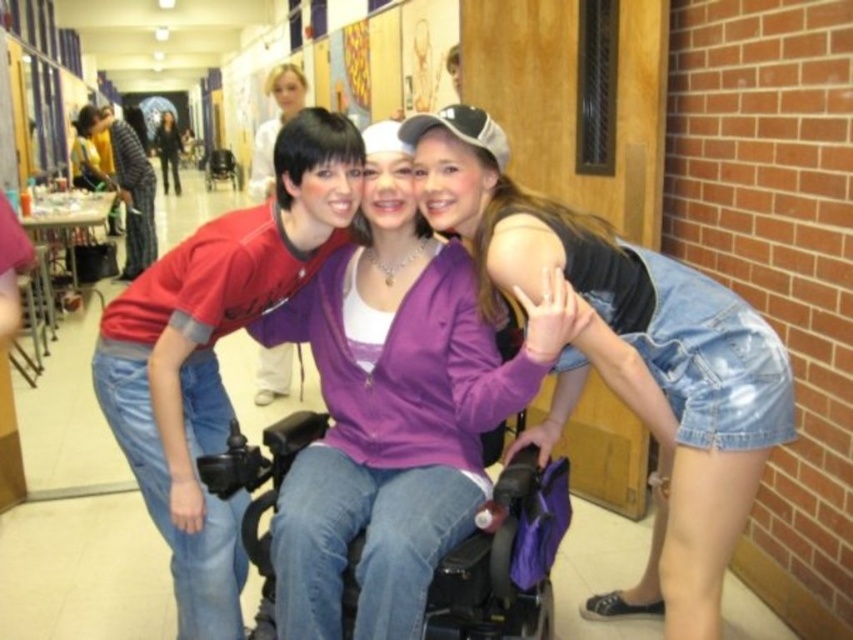
You are a student walking down the hallway and notice the denim shorts at right and the black plastic wheelchair at center. Which object is taller from your perspective?

The denim shorts at right is taller than the black plastic wheelchair at center.

You are a photographer setting up a shot in the school hallway. You want to position your camera so that both the denim shorts at right and the matte red shirt at left are in the frame. Based on their positions, which object should be placed closer to the right side of the camera frame?

The denim shorts at right should be placed closer to the right side of the camera frame since it is positioned to the right of the matte red shirt at left.

You are a student trying to decide which item to take from the center of the hallway. The purple matte jacket at center and the denim shorts at right are both on a bench. Which item is narrower?

The purple matte jacket at center is narrower than the denim shorts at right.